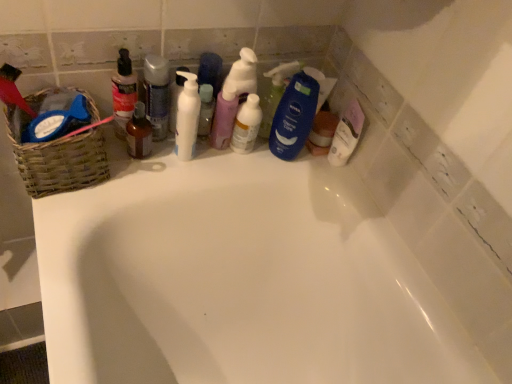
This screenshot has height=384, width=512. I want to click on free space in front of blue matte bottle at center, the 4th cleaning product when ordered from left to right, so click(255, 167).